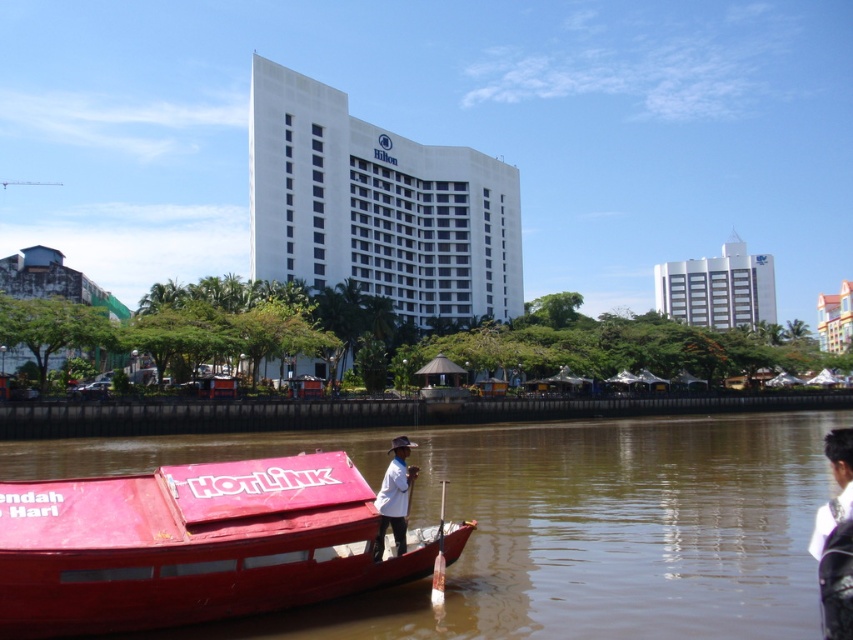
Measure the distance from white fabric shirt at lower right to white matte shirt at center.

white fabric shirt at lower right and white matte shirt at center are 25.72 meters apart.

Is point (814, 532) positioned behind point (410, 484)?

Yes, point (814, 532) is behind point (410, 484).

Which is in front, point (828, 554) or point (401, 528)?

Point (828, 554) is in front.

Where is `white fabric shirt at lower right`? The image size is (853, 640). white fabric shirt at lower right is located at coordinates (836, 540).

Who is shorter, brown matte river at lower center or red matte boat at lower left?

Standing shorter between the two is brown matte river at lower center.

Between brown matte river at lower center and red matte boat at lower left, which one has more height?

With more height is red matte boat at lower left.

Does point (653, 422) lie in front of point (138, 483)?

No, (653, 422) is further to viewer.

The width and height of the screenshot is (853, 640). What are the coordinates of `brown matte river at lower center` in the screenshot? It's located at (607, 532).

Between white matte shirt at center and wooden paddle at lower center, which one appears on the left side from the viewer's perspective?

white matte shirt at center

Does white matte shirt at center have a greater height compared to wooden paddle at lower center?

Indeed, white matte shirt at center has a greater height compared to wooden paddle at lower center.

I want to click on white matte shirt at center, so click(393, 497).